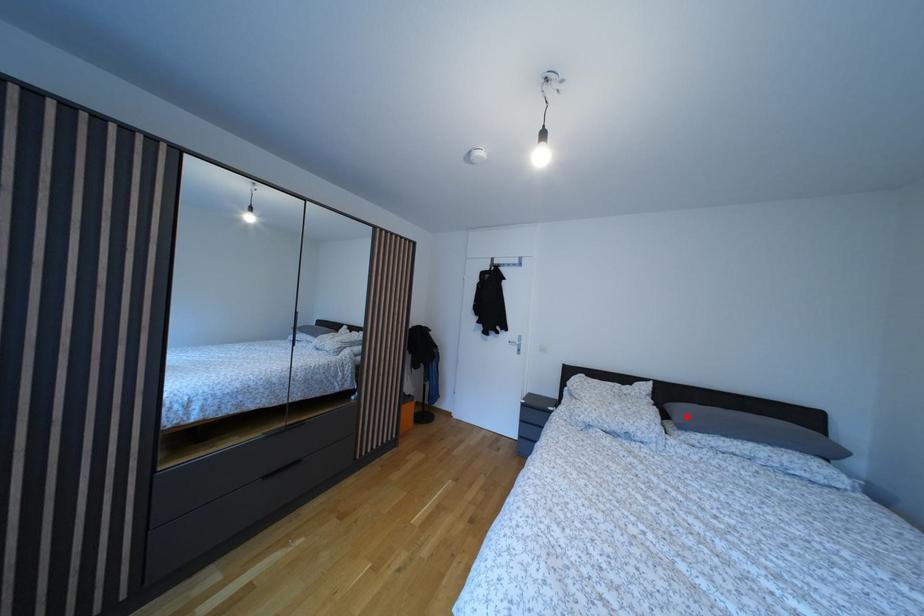
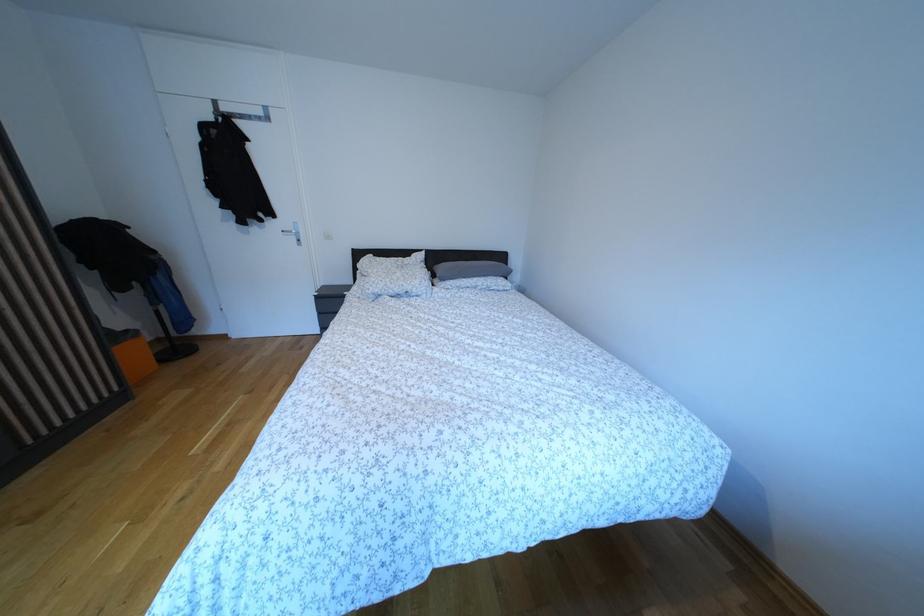
In the second image, find the point that corresponds to the highlighted location in the first image.

(447, 274)